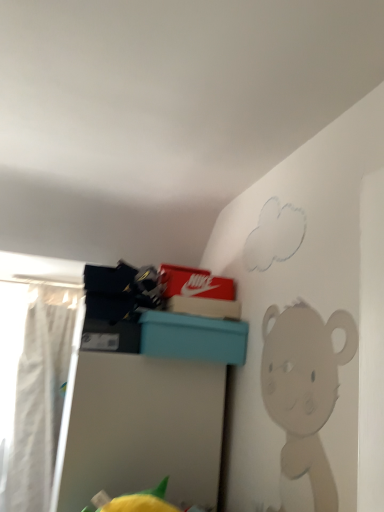
Question: Considering the relative sizes of white fabric curtain at left and teal plastic storage bin at upper center in the image provided, is white fabric curtain at left wider than teal plastic storage bin at upper center?

Choices:
 (A) yes
 (B) no

Answer: (B)

Question: Does white fabric curtain at left have a greater height compared to teal plastic storage bin at upper center?

Choices:
 (A) no
 (B) yes

Answer: (B)

Question: Is white fabric curtain at left positioned with its back to teal plastic storage bin at upper center?

Choices:
 (A) yes
 (B) no

Answer: (B)

Question: Would you say teal plastic storage bin at upper center is part of white fabric curtain at left's contents?

Choices:
 (A) yes
 (B) no

Answer: (B)

Question: Is white fabric curtain at left thinner than teal plastic storage bin at upper center?

Choices:
 (A) yes
 (B) no

Answer: (A)

Question: Considering the relative positions of white fabric curtain at left and teal plastic storage bin at upper center in the image provided, is white fabric curtain at left to the right of teal plastic storage bin at upper center from the viewer's perspective?

Choices:
 (A) no
 (B) yes

Answer: (A)

Question: Is teal plastic storage bin at upper center positioned far away from white fabric curtain at left?

Choices:
 (A) no
 (B) yes

Answer: (B)

Question: Is teal plastic storage bin at upper center positioned beyond the bounds of white fabric curtain at left?

Choices:
 (A) yes
 (B) no

Answer: (A)

Question: Does teal plastic storage bin at upper center come in front of white fabric curtain at left?

Choices:
 (A) yes
 (B) no

Answer: (A)

Question: From the image's perspective, is teal plastic storage bin at upper center on top of white fabric curtain at left?

Choices:
 (A) no
 (B) yes

Answer: (A)

Question: Can you confirm if teal plastic storage bin at upper center is bigger than white fabric curtain at left?

Choices:
 (A) no
 (B) yes

Answer: (B)

Question: Could you tell me if teal plastic storage bin at upper center is facing white fabric curtain at left?

Choices:
 (A) no
 (B) yes

Answer: (A)

Question: Looking at their shapes, would you say white fabric curtain at left is wider or thinner than teal plastic storage bin at upper center?

Choices:
 (A) thin
 (B) wide

Answer: (A)